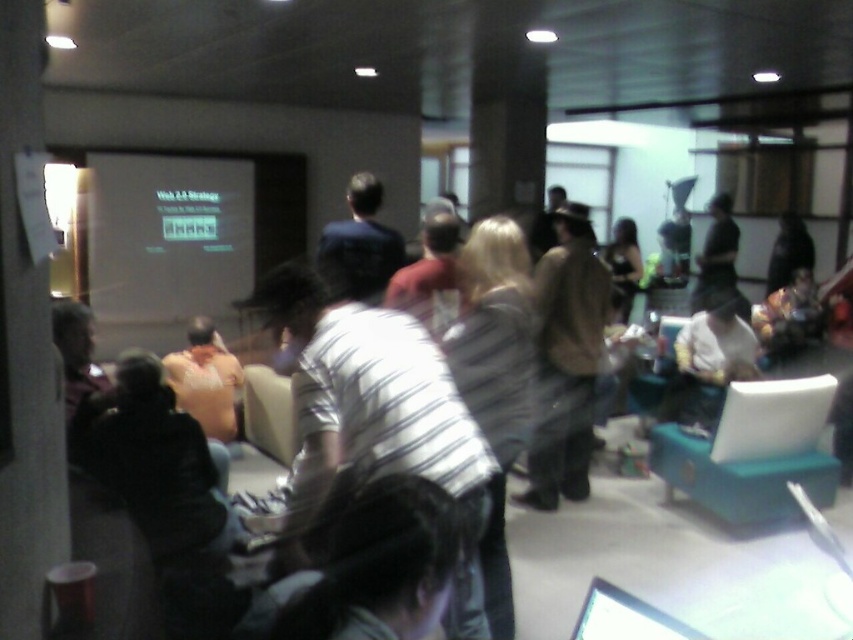
Who is more distant from viewer, (125, 269) or (556, 488)?

The point (125, 269) is more distant.

Image resolution: width=853 pixels, height=640 pixels. Identify the location of matte white projector screen at left. (167, 236).

Is point (117, 180) in front of point (554, 449)?

That is False.

Find the location of a particular element. This screenshot has height=640, width=853. matte white projector screen at left is located at coordinates (167, 236).

Does brown leather jacket at center have a greater height compared to dark blue shirt at center?

Yes, brown leather jacket at center is taller than dark blue shirt at center.

Is brown leather jacket at center shorter than dark blue shirt at center?

Incorrect, brown leather jacket at center's height does not fall short of dark blue shirt at center's.

Where is `brown leather jacket at center`? brown leather jacket at center is located at coordinates (566, 358).

Find the location of a particular element. This screenshot has width=853, height=640. brown leather jacket at center is located at coordinates (566, 358).

Can you confirm if matte white projector screen at left is positioned below dark blue shirt at center?

Actually, matte white projector screen at left is above dark blue shirt at center.

Based on the photo, between matte white projector screen at left and dark blue shirt at center, which one has less height?

Standing shorter between the two is dark blue shirt at center.

Identify the location of matte white projector screen at left. This screenshot has height=640, width=853. (167, 236).

Locate an element on the screen. matte white projector screen at left is located at coordinates (167, 236).